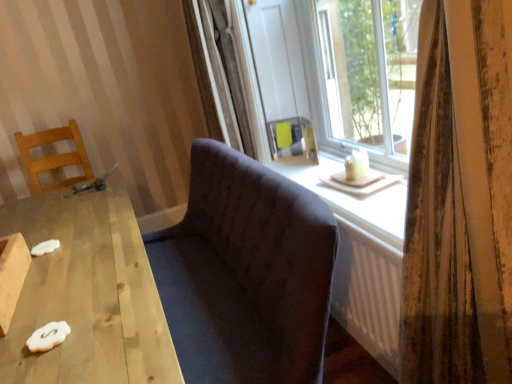
What do you see at coordinates (245, 273) in the screenshot? The image size is (512, 384). I see `dark fabric couch at center` at bounding box center [245, 273].

Describe the element at coordinates (54, 156) in the screenshot. I see `wooden chair at left` at that location.

Locate an element on the screen. This screenshot has height=384, width=512. dark fabric couch at center is located at coordinates (245, 273).

From the image's perspective, is wooden table at lower left above or below wooden chair at left?

wooden table at lower left is situated lower than wooden chair at left in the image.

Who is more distant, wooden table at lower left or wooden chair at left?

wooden chair at left is more distant.

Are wooden table at lower left and wooden chair at left beside each other?

No, wooden table at lower left is not making contact with wooden chair at left.

Considering the sizes of wooden table at lower left and wooden chair at left in the image, is wooden table at lower left wider or thinner than wooden chair at left?

wooden table at lower left is wider than wooden chair at left.

Between wooden chair at left and striped fabric curtain at right, which one has smaller size?

striped fabric curtain at right is smaller.

Is wooden chair at left outside of striped fabric curtain at right?

wooden chair at left is positioned outside striped fabric curtain at right.

The width and height of the screenshot is (512, 384). Find the location of `curtain that is in front of the wooden chair at left`. curtain that is in front of the wooden chair at left is located at coordinates (459, 201).

From a real-world perspective, is wooden chair at left located beneath striped fabric curtain at right?

Correct, in the physical world, wooden chair at left is lower than striped fabric curtain at right.

In the image, is dark fabric couch at center on the left side or the right side of wooden table at lower left?

In the image, dark fabric couch at center appears on the right side of wooden table at lower left.

How many degrees apart are the facing directions of dark fabric couch at center and wooden table at lower left?

There is a 1.69-degree angle between the facing directions of dark fabric couch at center and wooden table at lower left.

Looking at the image, does dark fabric couch at center seem bigger or smaller compared to wooden table at lower left?

Considering their sizes, dark fabric couch at center takes up less space than wooden table at lower left.

Choose the correct answer: Is dark fabric couch at center inside wooden table at lower left or outside it?

dark fabric couch at center is outside wooden table at lower left.

From the image's perspective, between wooden chair at left and dark fabric couch at center, which one is located above?

wooden chair at left appears higher in the image.

Which object is thinner, wooden chair at left or dark fabric couch at center?

With smaller width is wooden chair at left.

Is wooden chair at left completely or partially outside of dark fabric couch at center?

Yes.

Can you confirm if wooden chair at left is positioned to the left of dark fabric couch at center?

Correct, you'll find wooden chair at left to the left of dark fabric couch at center.

Is matte glass window at center oriented towards wooden chair at left?

No, matte glass window at center is not facing towards wooden chair at left.

Which object is further away from the camera, matte glass window at center or wooden chair at left?

wooden chair at left is more distant.

Is wooden chair at left inside matte glass window at center?

No, wooden chair at left is not a part of matte glass window at center.

From the picture: Which of these two, wooden chair at left or matte glass window at center, is thinner?

With smaller width is wooden chair at left.

From the picture: Which object is positioned more to the right, wooden chair at left or matte glass window at center?

matte glass window at center.

Where is `chair that is under the matte glass window at center (from a real-world perspective)`? chair that is under the matte glass window at center (from a real-world perspective) is located at coordinates (54, 156).

Is wooden chair at left aimed at matte glass window at center?

No, wooden chair at left does not turn towards matte glass window at center.

Which object is positioned more to the right, wooden table at lower left or dark fabric couch at center?

dark fabric couch at center is more to the right.

Does point (110, 258) appear closer or farther from the camera than point (199, 223)?

Point (110, 258).

At what (x,y) coordinates should I click in order to perform the action: click on table on the left of dark fabric couch at center. Please return your answer as a coordinate pair (x, y). The image size is (512, 384). Looking at the image, I should click on (87, 294).

In the scene shown: Could you tell me if wooden table at lower left is turned towards dark fabric couch at center?

Yes, wooden table at lower left faces towards dark fabric couch at center.

This screenshot has width=512, height=384. What are the coordinates of `chair on the left of wooden table at lower left` in the screenshot? It's located at (54, 156).

Where is `chair behind the striped fabric curtain at right`? The image size is (512, 384). chair behind the striped fabric curtain at right is located at coordinates (54, 156).

Considering their positions, is wooden chair at left positioned closer to wooden table at lower left than striped fabric curtain at right?

The object closer to wooden table at lower left is striped fabric curtain at right.

Looking at the image, which one is located closer to matte glass window at center, striped fabric curtain at right or dark fabric couch at center?

Based on the image, dark fabric couch at center appears to be nearer to matte glass window at center.

Estimate the real-world distances between objects in this image. Which object is further from wooden table at lower left, dark fabric couch at center or striped fabric curtain at right?

Among the two, striped fabric curtain at right is located further to wooden table at lower left.

Estimate the real-world distances between objects in this image. Which object is closer to wooden table at lower left, matte glass window at center or dark fabric couch at center?

dark fabric couch at center lies closer to wooden table at lower left than the other object.

When comparing their distances from dark fabric couch at center, does matte glass window at center or striped fabric curtain at right seem further?

matte glass window at center lies further to dark fabric couch at center than the other object.

Considering their positions, is dark fabric couch at center positioned closer to matte glass window at center than striped fabric curtain at right?

Based on the image, dark fabric couch at center appears to be nearer to matte glass window at center.

When comparing their distances from dark fabric couch at center, does wooden table at lower left or matte glass window at center seem further?

The object further to dark fabric couch at center is matte glass window at center.

Considering their positions, is wooden table at lower left positioned further to matte glass window at center than striped fabric curtain at right?

wooden table at lower left is positioned further to the anchor matte glass window at center.

You are a GUI agent. You are given a task and a screenshot of the screen. Output one action in this format:
    pyautogui.click(x=<x>, y=<y>)
    Task: Click on the curtain between matte glass window at center and dark fabric couch at center vertically
    Image resolution: width=512 pixels, height=384 pixels.
    Given the screenshot: What is the action you would take?
    pyautogui.click(x=459, y=201)

Where is `studio couch located between wooden table at lower left and wooden chair at left in the depth direction`? This screenshot has height=384, width=512. studio couch located between wooden table at lower left and wooden chair at left in the depth direction is located at coordinates (245, 273).

The image size is (512, 384). I want to click on table between striped fabric curtain at right and wooden chair at left along the z-axis, so click(87, 294).

Locate an element on the screen. The image size is (512, 384). curtain between wooden table at lower left and matte glass window at center from left to right is located at coordinates (459, 201).